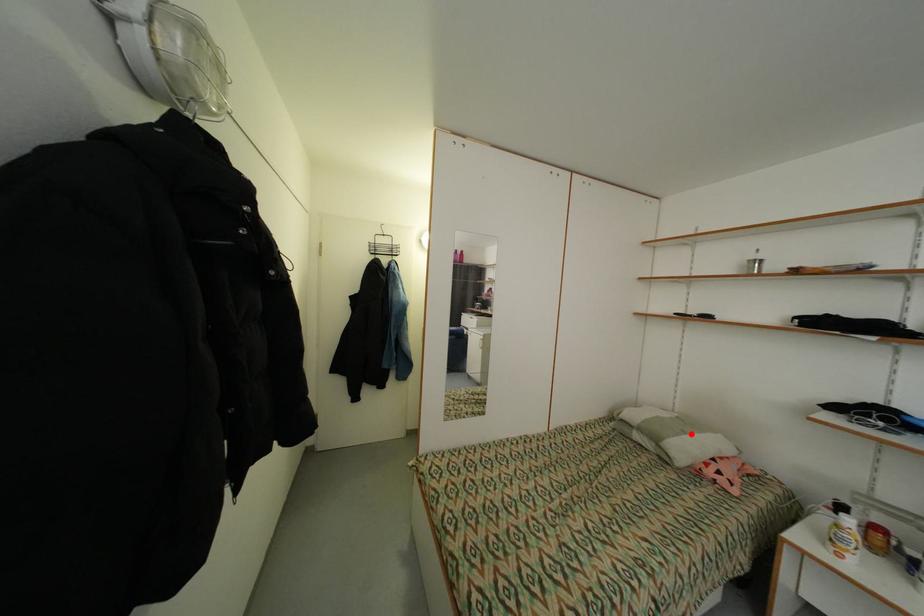
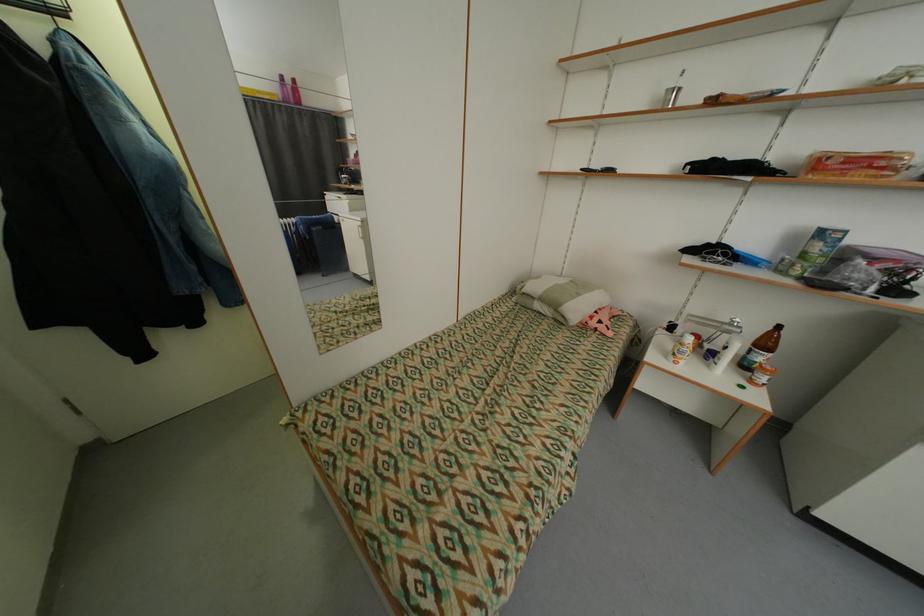
Question: I am providing you with two images of the same scene from different viewpoints. A red point is shown in image1. For the corresponding object point in image2, is it positioned nearer or farther from the camera?

Choices:
 (A) Nearer
 (B) Farther

Answer: (A)